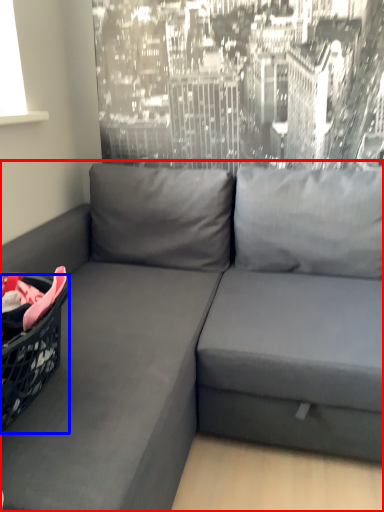
Question: Which of the following is the closest to the observer, studio couch (highlighted by a red box) or basket (highlighted by a blue box)?

Choices:
 (A) studio couch
 (B) basket

Answer: (A)